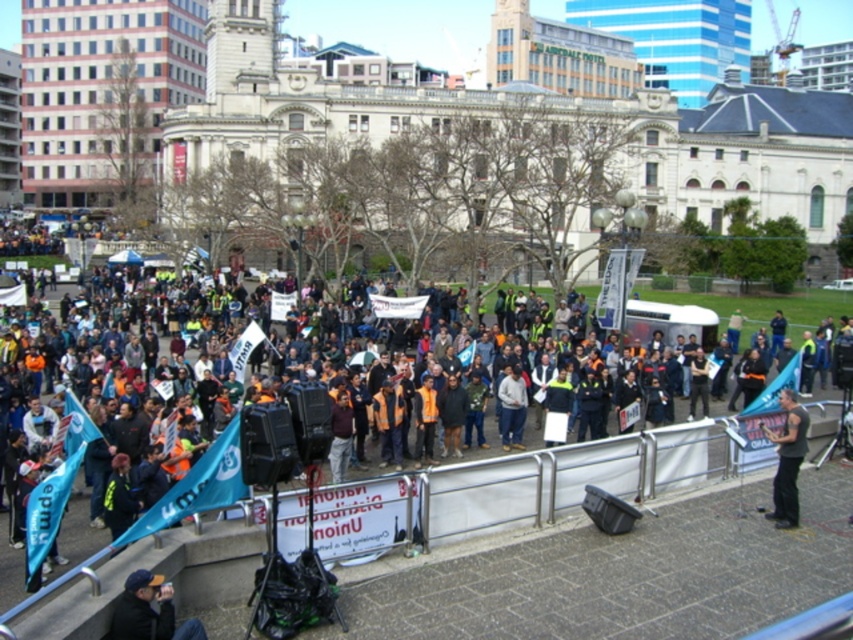
You are a photographer trying to capture a clear photo of the protest. You notice the dark blue knit cap at lower left and the black fabric shirt at lower right are blocking your view. Which object should you move closer to your camera to make it appear larger in the photo?

The dark blue knit cap at lower left is smaller than the black fabric shirt at lower right. To make an object appear larger in the photo, you should move closer to the smaller object, which is the dark blue knit cap at lower left.